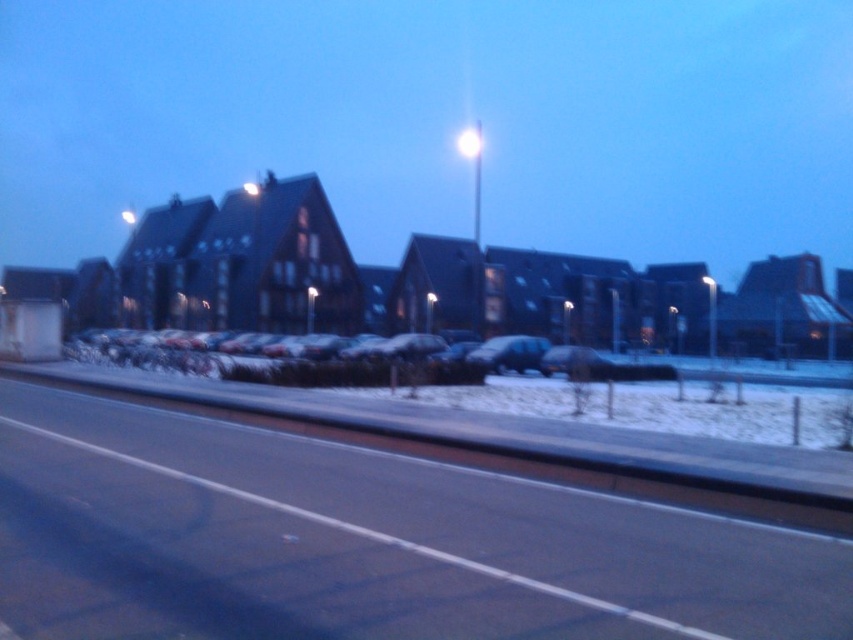
Question: Is smooth concrete street at lower left wider than snow-covered cars at center?

Choices:
 (A) yes
 (B) no

Answer: (A)

Question: Considering the relative positions of smooth concrete street at lower left and snow-covered cars at center in the image provided, where is smooth concrete street at lower left located with respect to snow-covered cars at center?

Choices:
 (A) above
 (B) below

Answer: (A)

Question: Which point is farther to the camera?

Choices:
 (A) (519, 93)
 (B) (421, 353)

Answer: (A)

Question: Can you confirm if smooth concrete street at lower left is positioned to the right of snow-covered cars at center?

Choices:
 (A) no
 (B) yes

Answer: (B)